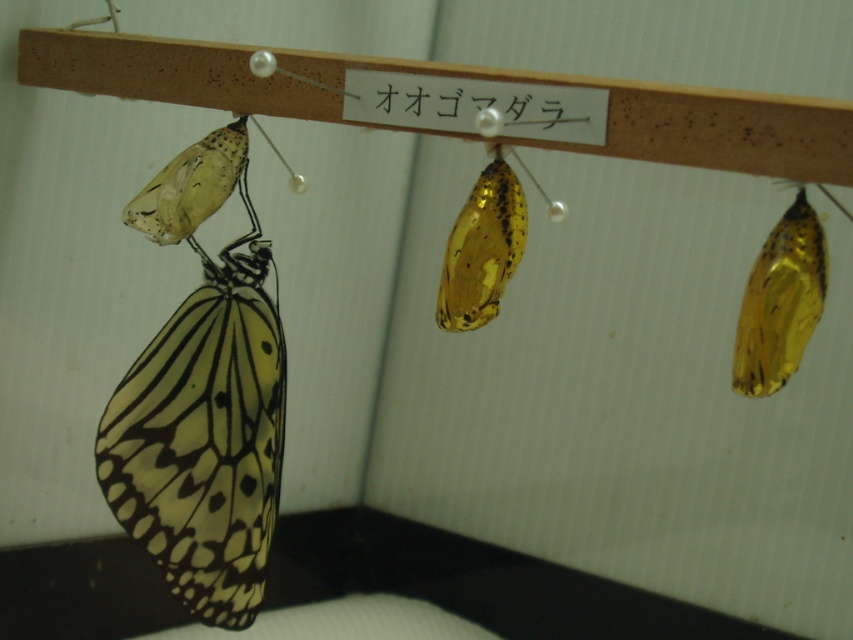
Does translucent amber chrysalis at right appear under translucent yellow pupa at center?

Indeed, translucent amber chrysalis at right is positioned under translucent yellow pupa at center.

The width and height of the screenshot is (853, 640). Describe the element at coordinates (780, 301) in the screenshot. I see `translucent amber chrysalis at right` at that location.

What do you see at coordinates (780, 301) in the screenshot? The width and height of the screenshot is (853, 640). I see `translucent amber chrysalis at right` at bounding box center [780, 301].

The image size is (853, 640). I want to click on translucent amber chrysalis at right, so (780, 301).

Who is more distant from viewer, (177,506) or (764,314)?

Point (177,506)

Is point (96, 477) positioned after point (778, 284)?

Yes, point (96, 477) is farther from viewer.

Locate an element on the screen. The height and width of the screenshot is (640, 853). yellow translucent butterfly at lower left is located at coordinates (204, 440).

Does yellow translucent butterfly at lower left have a lesser height compared to translucent amber chrysalis at center?

Incorrect, yellow translucent butterfly at lower left's height does not fall short of translucent amber chrysalis at center's.

Between point (270, 468) and point (241, 145), which one is positioned behind?

Positioned behind is point (270, 468).

You are a GUI agent. You are given a task and a screenshot of the screen. Output one action in this format:
    pyautogui.click(x=<x>, y=<y>)
    Task: Click on the yellow translucent butterfly at lower left
    This screenshot has height=640, width=853.
    Given the screenshot: What is the action you would take?
    pyautogui.click(x=204, y=440)